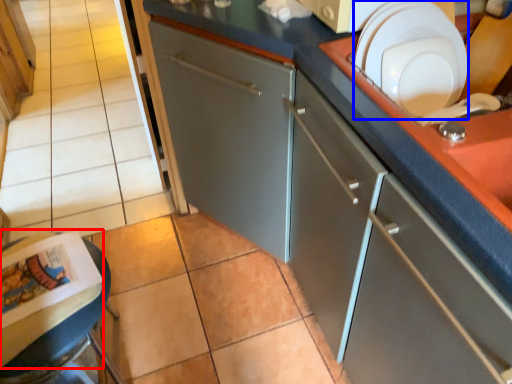
Question: Among these objects, which one is nearest to the camera, magazine (highlighted by a red box) or tableware (highlighted by a blue box)?

Choices:
 (A) magazine
 (B) tableware

Answer: (B)